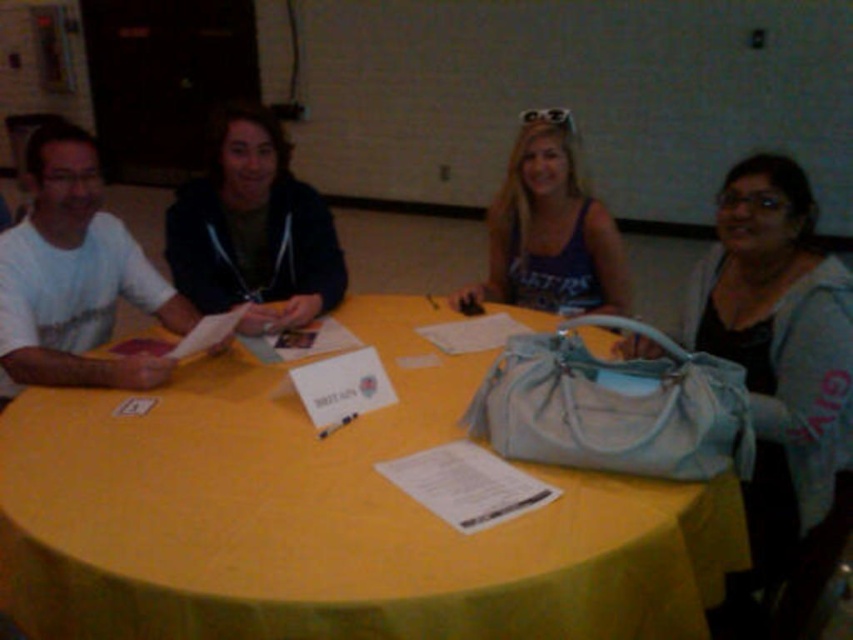
You are a person sitting at the round table and want to reach the matte blue purse at right without moving your chair. Which direction should you turn to face the matte purple tank top at center first before reaching for the purse?

You should turn to your right to face the matte purple tank top at center first, as the matte blue purse at right is located below it.

You are standing in the room and want to reach the point at coordinates point (480, 588). If your current position is 1.5 meters away from the table, can you reach it without moving past the table?

The point (480, 588) is 1.04 meters from the viewer. Since your current position is 1.5 meters away from the table, you are already closer than the required distance to reach the point. Therefore, you can reach it without moving past the table.